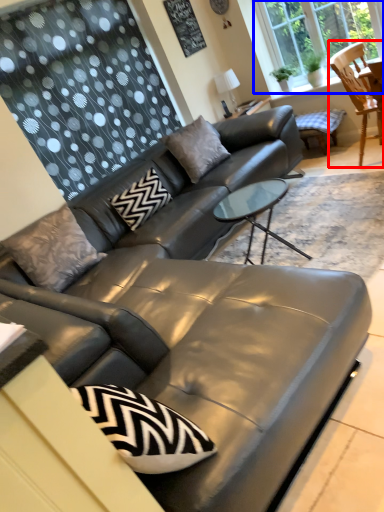
Question: Which object appears closest to the camera in this image, chair (highlighted by a red box) or window (highlighted by a blue box)?

Choices:
 (A) chair
 (B) window

Answer: (A)